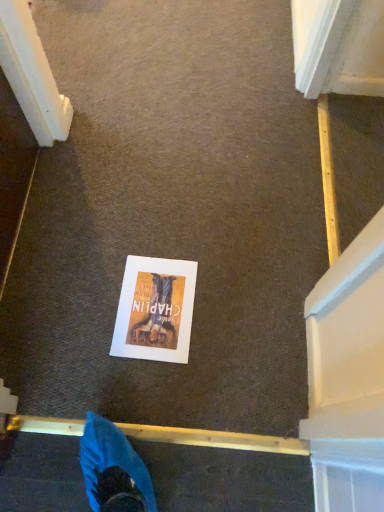
Locate an element on the screen. Image resolution: width=384 pixels, height=512 pixels. free space to the left of white paper at center is located at coordinates (77, 306).